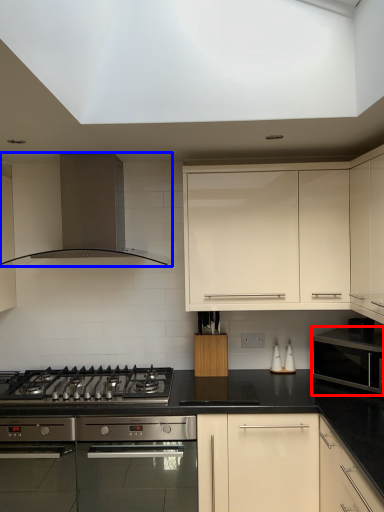
Question: Which object is further to the camera taking this photo, microwave oven (highlighted by a red box) or kitchen appliance (highlighted by a blue box)?

Choices:
 (A) microwave oven
 (B) kitchen appliance

Answer: (B)